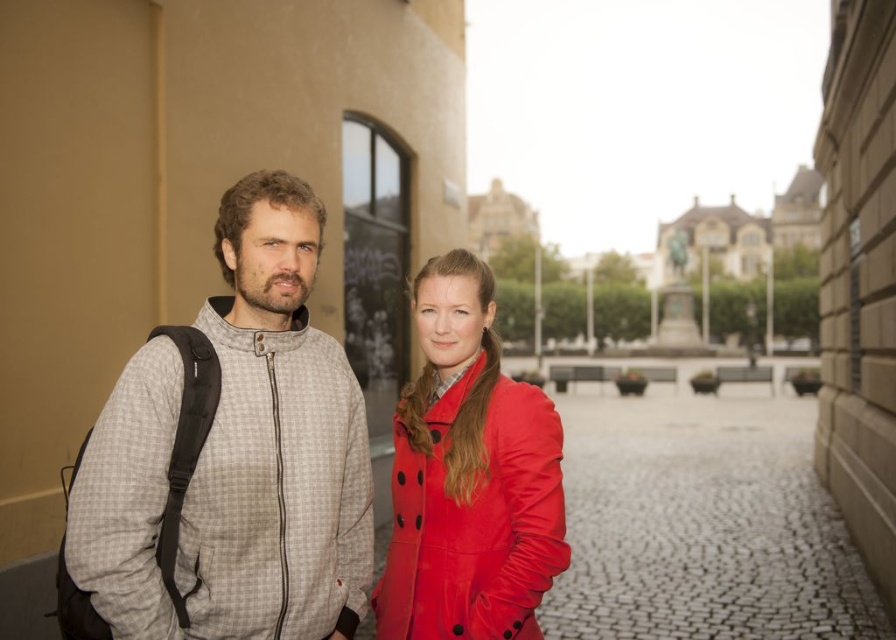
You are a photographer trying to capture both the gray checkered jacket at left and the shiny red coat at center in a single shot. Based on their positions, which one will appear larger in your photo?

The gray checkered jacket at left appears closer to the viewer than the shiny red coat at center, so it will look larger in the photo.

You are a photographer positioned at the statue in the background. You want to take a photo of both the gray checkered jacket at left and the shiny red coat at center. Can you fit both subjects in the frame without moving your position? Explain your reasoning.

The gray checkered jacket at left is 1.89 meters away from the shiny red coat at center. Since the distance between them is less than the typical camera frame width, you can likely fit both subjects in the frame without moving your position.

You are standing in the plaza and want to locate the gray checkered jacket at left. What are the coordinates of its position?

The gray checkered jacket at left is located at coordinates (237, 454).